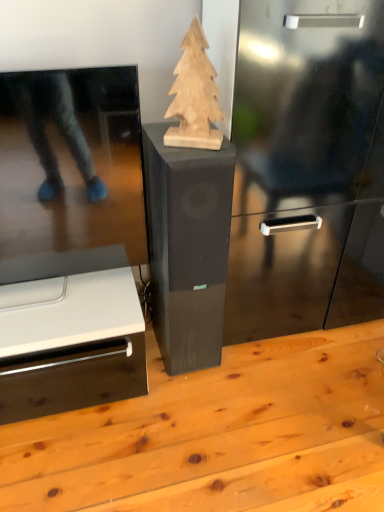
Question: From the image's perspective, is natural wood christmas tree at center located beneath light brown wood table at center?

Choices:
 (A) yes
 (B) no

Answer: (B)

Question: Can you see natural wood christmas tree at center touching light brown wood table at center?

Choices:
 (A) no
 (B) yes

Answer: (A)

Question: Is natural wood christmas tree at center shorter than light brown wood table at center?

Choices:
 (A) yes
 (B) no

Answer: (B)

Question: Considering the relative positions of natural wood christmas tree at center and light brown wood table at center in the image provided, is natural wood christmas tree at center to the right of light brown wood table at center from the viewer's perspective?

Choices:
 (A) yes
 (B) no

Answer: (B)

Question: Considering the relative sizes of natural wood christmas tree at center and light brown wood table at center in the image provided, is natural wood christmas tree at center bigger than light brown wood table at center?

Choices:
 (A) no
 (B) yes

Answer: (A)

Question: In the image, is natural wood christmas tree at center positioned in front of or behind light brown wood table at center?

Choices:
 (A) behind
 (B) front

Answer: (A)

Question: Looking at their shapes, would you say natural wood christmas tree at center is wider or thinner than light brown wood table at center?

Choices:
 (A) thin
 (B) wide

Answer: (A)

Question: From a real-world perspective, is natural wood christmas tree at center positioned above or below light brown wood table at center?

Choices:
 (A) below
 (B) above

Answer: (B)

Question: In terms of size, does natural wood christmas tree at center appear bigger or smaller than light brown wood table at center?

Choices:
 (A) big
 (B) small

Answer: (B)

Question: Based on their sizes in the image, would you say black wood speaker at center is bigger or smaller than natural wood christmas tree at center?

Choices:
 (A) big
 (B) small

Answer: (A)

Question: From the image's perspective, is black wood speaker at center positioned above or below natural wood christmas tree at center?

Choices:
 (A) below
 (B) above

Answer: (A)

Question: Is point (198, 196) closer or farther from the camera than point (195, 125)?

Choices:
 (A) farther
 (B) closer

Answer: (A)

Question: Considering their positions, is black wood speaker at center located in front of or behind natural wood christmas tree at center?

Choices:
 (A) behind
 (B) front

Answer: (A)

Question: Looking at their shapes, would you say light brown wood table at center is wider or thinner than natural wood christmas tree at center?

Choices:
 (A) wide
 (B) thin

Answer: (A)

Question: From a real-world perspective, relative to natural wood christmas tree at center, is light brown wood table at center vertically above or below?

Choices:
 (A) above
 (B) below

Answer: (B)